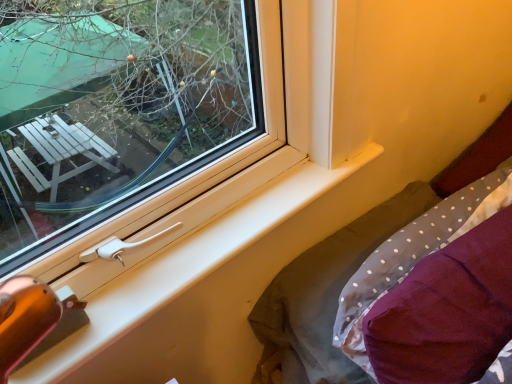
Question: Does maroon fabric pillow at lower right have a greater height compared to gray polka dot fabric at lower right?

Choices:
 (A) yes
 (B) no

Answer: (B)

Question: Does maroon fabric pillow at lower right have a lesser height compared to gray polka dot fabric at lower right?

Choices:
 (A) no
 (B) yes

Answer: (B)

Question: Would you say maroon fabric pillow at lower right contains gray polka dot fabric at lower right?

Choices:
 (A) no
 (B) yes

Answer: (A)

Question: Does maroon fabric pillow at lower right have a larger size compared to gray polka dot fabric at lower right?

Choices:
 (A) no
 (B) yes

Answer: (A)

Question: Is maroon fabric pillow at lower right directly adjacent to gray polka dot fabric at lower right?

Choices:
 (A) no
 (B) yes

Answer: (A)

Question: Does maroon fabric pillow at lower right appear on the left side of gray polka dot fabric at lower right?

Choices:
 (A) no
 (B) yes

Answer: (A)

Question: Is white plastic window sill at lower left not within gray polka dot fabric at lower right?

Choices:
 (A) yes
 (B) no

Answer: (A)

Question: From the image's perspective, does white plastic window sill at lower left appear higher than gray polka dot fabric at lower right?

Choices:
 (A) no
 (B) yes

Answer: (B)

Question: Considering the relative sizes of white plastic window sill at lower left and gray polka dot fabric at lower right in the image provided, is white plastic window sill at lower left bigger than gray polka dot fabric at lower right?

Choices:
 (A) yes
 (B) no

Answer: (B)

Question: Is white plastic window sill at lower left smaller than gray polka dot fabric at lower right?

Choices:
 (A) yes
 (B) no

Answer: (A)

Question: Is white plastic window sill at lower left to the right of gray polka dot fabric at lower right from the viewer's perspective?

Choices:
 (A) yes
 (B) no

Answer: (B)

Question: Is white plastic window sill at lower left shorter than gray polka dot fabric at lower right?

Choices:
 (A) yes
 (B) no

Answer: (A)

Question: Considering the relative sizes of gray polka dot fabric at lower right and maroon fabric pillow at lower right in the image provided, is gray polka dot fabric at lower right shorter than maroon fabric pillow at lower right?

Choices:
 (A) no
 (B) yes

Answer: (A)